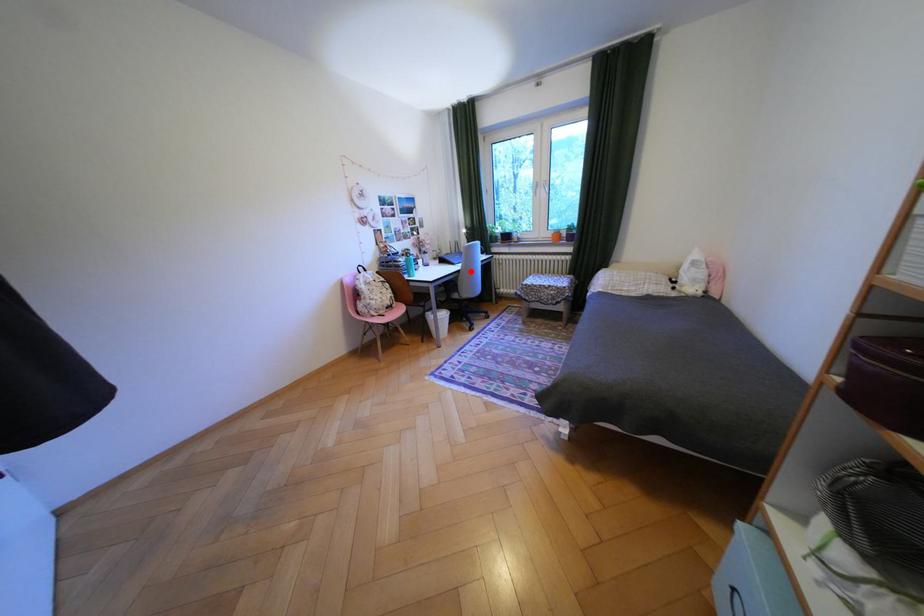
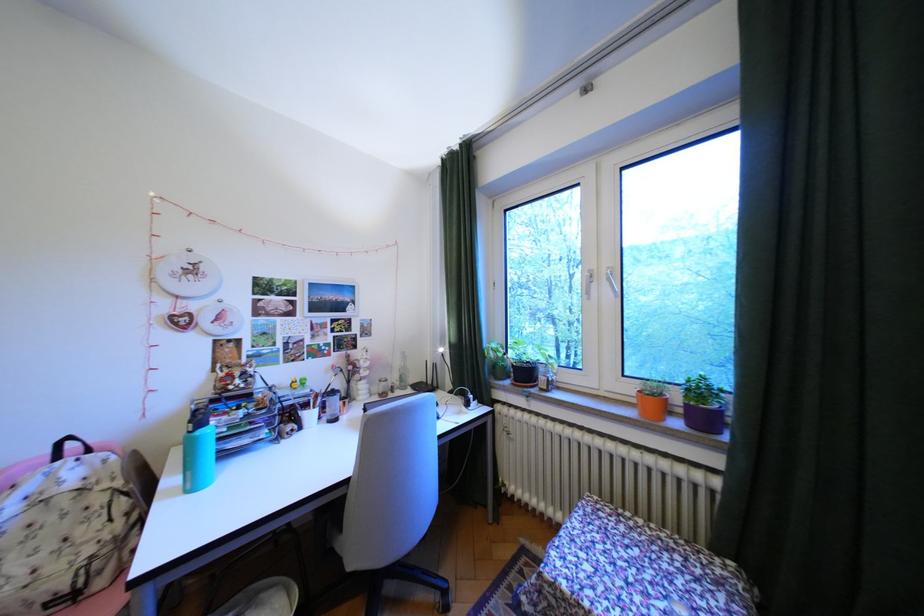
Question: I am providing you with two images of the same scene from different viewpoints. Given a red point in image1, look at the same physical point in image2. Is it:

Choices:
 (A) Closer to the viewpoint
 (B) Farther from the viewpoint

Answer: (B)